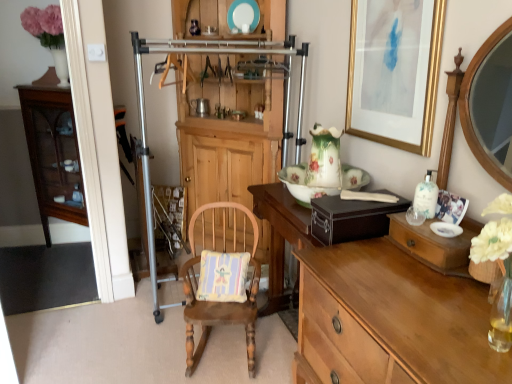
Locate an element on the screen. The width and height of the screenshot is (512, 384). free spot below wooden rocking chair with cushion at center (from a real-world perspective) is located at coordinates (221, 344).